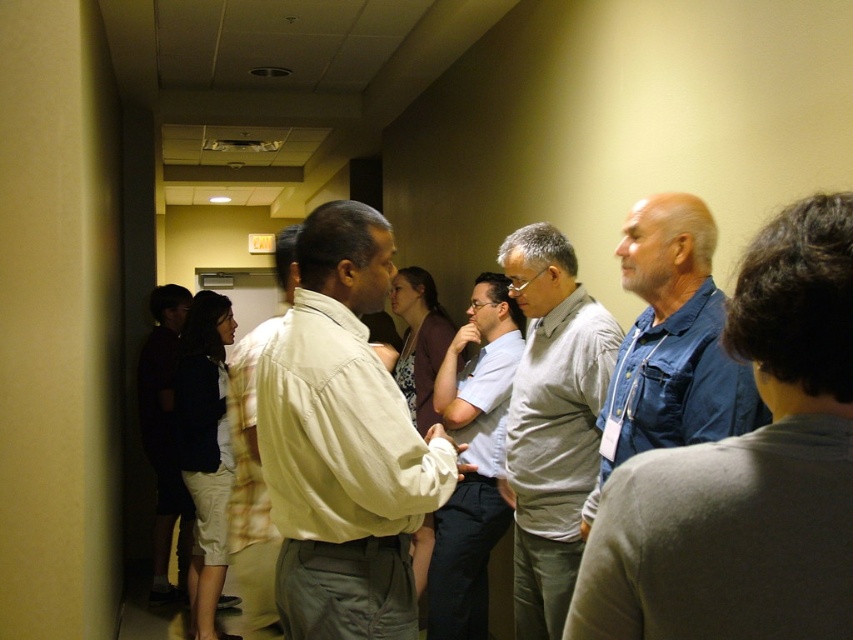
Can you confirm if denim jacket at right is taller than dark blue shirt at left?

No, denim jacket at right is not taller than dark blue shirt at left.

Does denim jacket at right appear under dark blue shirt at left?

No.

At what (x,y) coordinates should I click in order to perform the action: click on denim jacket at right. Please return your answer as a coordinate pair (x, y). Image resolution: width=853 pixels, height=640 pixels. Looking at the image, I should click on coord(672,339).

Between denim jacket at right and light beige shirt at center, which one has less height?

denim jacket at right

Who is positioned more to the right, denim jacket at right or light beige shirt at center?

From the viewer's perspective, denim jacket at right appears more on the right side.

Is point (657, 241) positioned before point (262, 525)?

That is True.

Locate an element on the screen. denim jacket at right is located at coordinates (672, 339).

Who is taller, beige cotton shirt at center or denim jacket at right?

beige cotton shirt at center

Is point (376, 444) positioned in front of point (643, 298)?

Yes, point (376, 444) is in front of point (643, 298).

Where is `beige cotton shirt at center`? The width and height of the screenshot is (853, 640). beige cotton shirt at center is located at coordinates (343, 442).